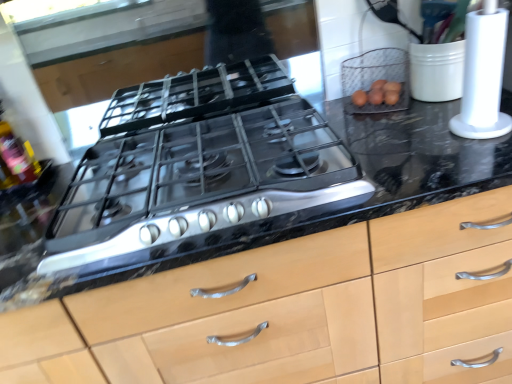
Question: Is translucent plastic bottle at left inside or outside of white plastic paper towel holder at right?

Choices:
 (A) inside
 (B) outside

Answer: (B)

Question: Relative to white plastic paper towel holder at right, is translucent plastic bottle at left in front or behind?

Choices:
 (A) front
 (B) behind

Answer: (B)

Question: Estimate the real-world distances between objects in this image. Which object is farther from the black marble countertop at center?

Choices:
 (A) wire mesh basket at upper right
 (B) translucent plastic bottle at left
 (C) white plastic paper towel holder at right

Answer: (B)

Question: Considering the real-world distances, which object is closest to the translucent plastic bottle at left?

Choices:
 (A) wire mesh basket at upper right
 (B) white plastic paper towel holder at right
 (C) black marble countertop at center

Answer: (C)